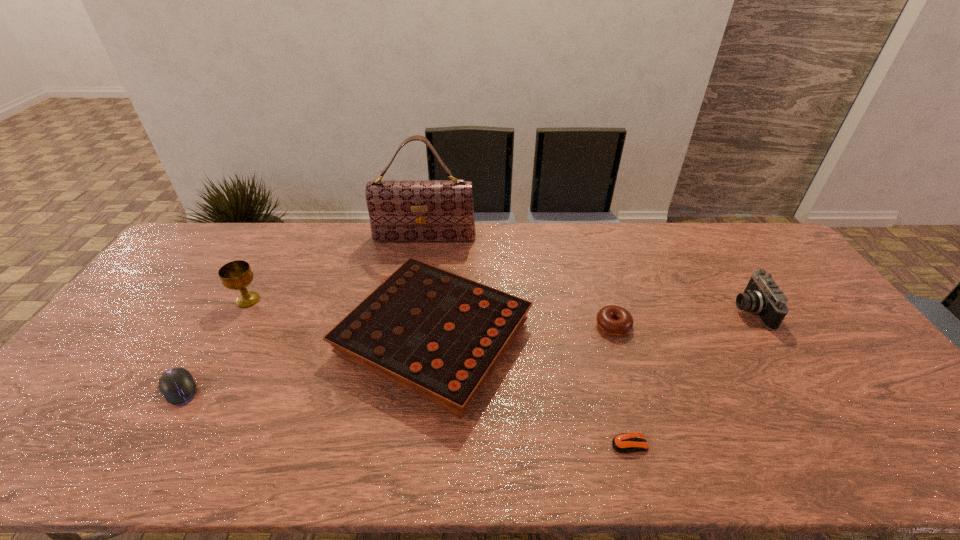
At what (x,y) coordinates should I click in order to perform the action: click on the farthest object. Please return your answer as a coordinate pair (x, y). This screenshot has width=960, height=540. Looking at the image, I should click on (399, 210).

Where is `the tallest object`? This screenshot has height=540, width=960. the tallest object is located at coordinates (399, 210).

At what (x,y) coordinates should I click in order to perform the action: click on chalice. Please return your answer as a coordinate pair (x, y). This screenshot has width=960, height=540. Looking at the image, I should click on (237, 275).

This screenshot has height=540, width=960. I want to click on the rightmost object, so click(x=762, y=296).

This screenshot has height=540, width=960. What are the coordinates of `gameboard` in the screenshot? It's located at (437, 334).

Identify the location of doughnut. (615, 320).

This screenshot has height=540, width=960. What are the coordinates of `the left computer mouse` in the screenshot? It's located at (177, 386).

Identify the location of the taller computer mouse. (177, 386).

This screenshot has width=960, height=540. What are the coordinates of `the nearest object` in the screenshot? It's located at (623, 443).

Where is `the shortest object`? The image size is (960, 540). the shortest object is located at coordinates (623, 443).